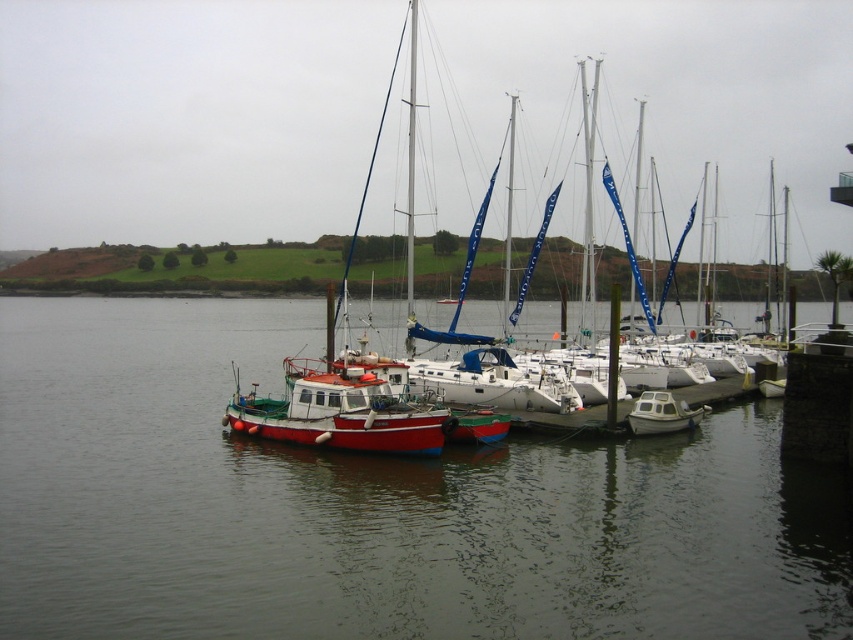
Is smooth water at center wider than white plastic dinghy at lower right?

Yes, smooth water at center is wider than white plastic dinghy at lower right.

Can you confirm if smooth water at center is smaller than white plastic dinghy at lower right?

Incorrect, smooth water at center is not smaller in size than white plastic dinghy at lower right.

Between point (685, 532) and point (634, 416), which one is positioned in front?

Point (685, 532)

Where is `smooth water at center`? smooth water at center is located at coordinates (370, 506).

Can you confirm if smooth water at center is positioned to the left of red matte fishing boat at center?

Indeed, smooth water at center is positioned on the left side of red matte fishing boat at center.

Is smooth water at center shorter than red matte fishing boat at center?

No.

Which is in front, point (451, 529) or point (381, 401)?

Point (451, 529) is more forward.

Locate an element on the screen. The height and width of the screenshot is (640, 853). smooth water at center is located at coordinates (370, 506).

Does point (297, 429) come farther from viewer compared to point (666, 397)?

That is False.

Who is more forward, (405, 452) or (660, 396)?

Point (405, 452) is in front.

Where is `red matte fishing boat at center`? The width and height of the screenshot is (853, 640). red matte fishing boat at center is located at coordinates point(338,412).